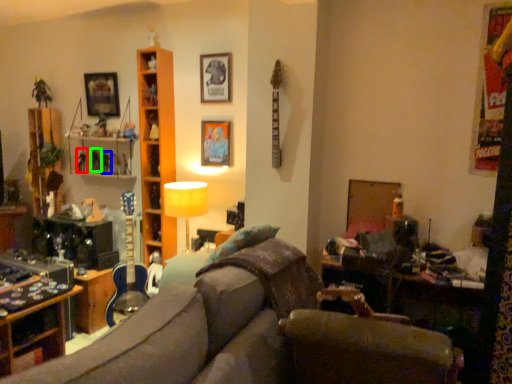
Question: Which object is the farthest from toy (highlighted by a red box)? Choose among these: toy (highlighted by a blue box) or toy (highlighted by a green box).

Choices:
 (A) toy
 (B) toy

Answer: (A)